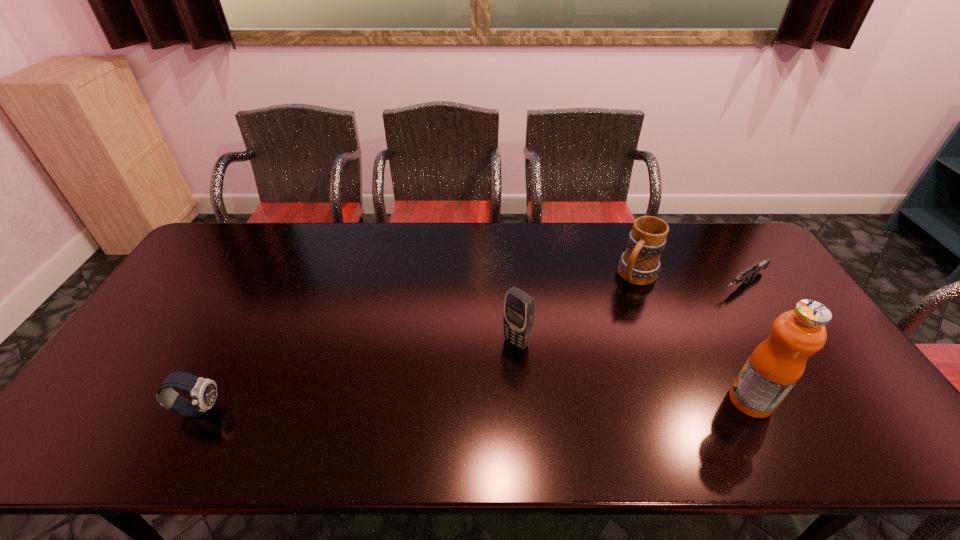
Locate an element on the screen. This screenshot has height=540, width=960. vacant space located 0.180m on the left of the second object from right to left is located at coordinates (657, 401).

Where is `vacant area situated on the side of the mug with the handle`? This screenshot has width=960, height=540. vacant area situated on the side of the mug with the handle is located at coordinates (571, 363).

This screenshot has width=960, height=540. I want to click on blank space located 0.280m on the side of the mug with the handle, so click(586, 345).

Locate an element on the screen. Image resolution: width=960 pixels, height=540 pixels. vacant space located 0.060m on the side of the mug with the handle is located at coordinates (619, 300).

I want to click on vacant space located on the front face of the third nearest object, so click(440, 409).

At what (x,y) coordinates should I click in order to perform the action: click on free space located 0.070m on the front face of the third nearest object. Please return your answer as a coordinate pair (x, y). Looking at the image, I should click on (490, 366).

The image size is (960, 540). Identify the location of free space located on the front face of the third nearest object. (495, 361).

Find the location of a particular element. The image size is (960, 540). vacant space located 0.360m aimed along the barrel of the rightmost object is located at coordinates (642, 342).

Find the location of a particular element. The image size is (960, 540). blank space located 0.160m aimed along the barrel of the rightmost object is located at coordinates (688, 313).

Find the location of a particular element. This screenshot has width=960, height=540. vacant space located aimed along the barrel of the rightmost object is located at coordinates (684, 315).